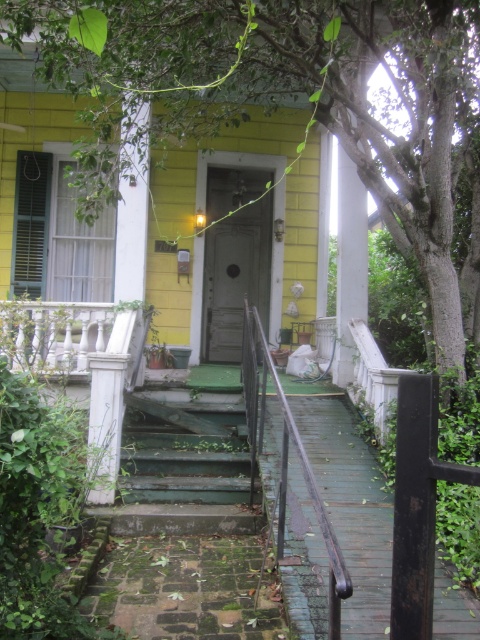
You are a painter who needs to paint both the green painted wood porch at center and the white marble balustrade at left. Which object requires less paint because it is smaller in size?

The green painted wood porch at center requires less paint because it occupies less space than the white marble balustrade at left.

You are a delivery person carrying a large package that is 2 meters wide. You need to walk up the green weathered wood stairs at center to reach the green painted wood porch at center. Can your package fit through the space between the stairs and the porch?

The green painted wood porch at center is narrower than the green weathered wood stairs at center, so the 2 meter wide package may not fit through the space since the porch is narrower than the stairs.